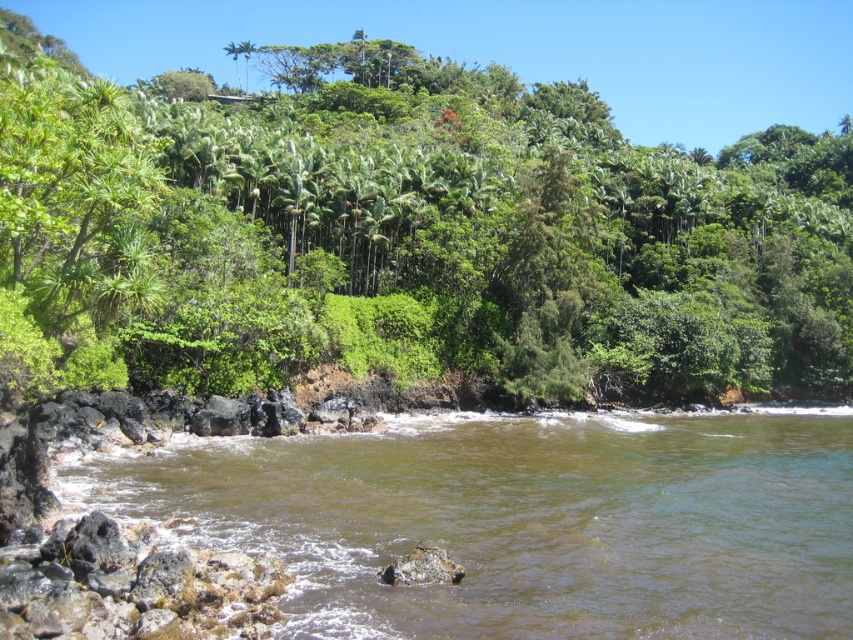
Question: Which point is closer to the camera?

Choices:
 (A) brown rocky river at lower left
 (B) green leafy tree at upper center
 (C) green leafy palm tree at upper center

Answer: (B)

Question: Which point is farther to the camera?

Choices:
 (A) green leafy palm tree at upper center
 (B) brown rocky river at lower left

Answer: (A)

Question: Is green leafy tree at upper center thinner than brown rocky river at lower left?

Choices:
 (A) yes
 (B) no

Answer: (B)

Question: Does green leafy tree at upper center have a smaller size compared to brown rocky river at lower left?

Choices:
 (A) no
 (B) yes

Answer: (A)

Question: Does brown rocky river at lower left have a smaller size compared to green leafy palm tree at upper center?

Choices:
 (A) yes
 (B) no

Answer: (A)

Question: Which point appears closest to the camera in this image?

Choices:
 (A) (248, 44)
 (B) (328, 605)
 (C) (320, 314)

Answer: (B)